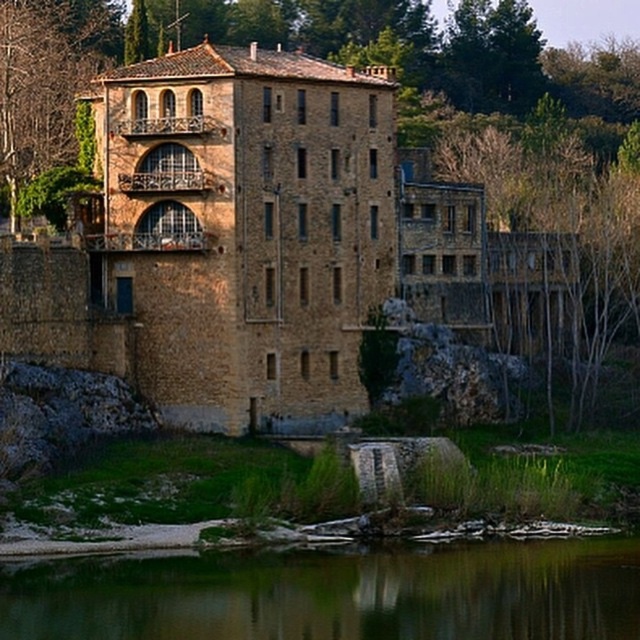
You are standing in front of the historic stone building by the water. There are two points marked in the image. The first point is at coordinates point (221, 566) and the second is at point (60, 77). Which point is nearer to you?

Point (221, 566) is closer to the camera than point (60, 77), so the first point is nearer to you.

You are an architect designing a new garden path that needs to pass between the green reflective water at lower center and the green leafy tree at upper left. Based on their positions, which direction should the path curve to avoid both objects?

The green reflective water at lower center is positioned under the green leafy tree at upper left, so the path should curve to the right to avoid both objects.

You are standing on the dock and want to take a photo of the green leafy tree at upper center and the green reflective water at lower center. Which object will appear larger in the photo?

The green leafy tree at upper center is positioned over green reflective water at lower center, so the tree will appear larger in the photo because it is closer to the camera than the water.